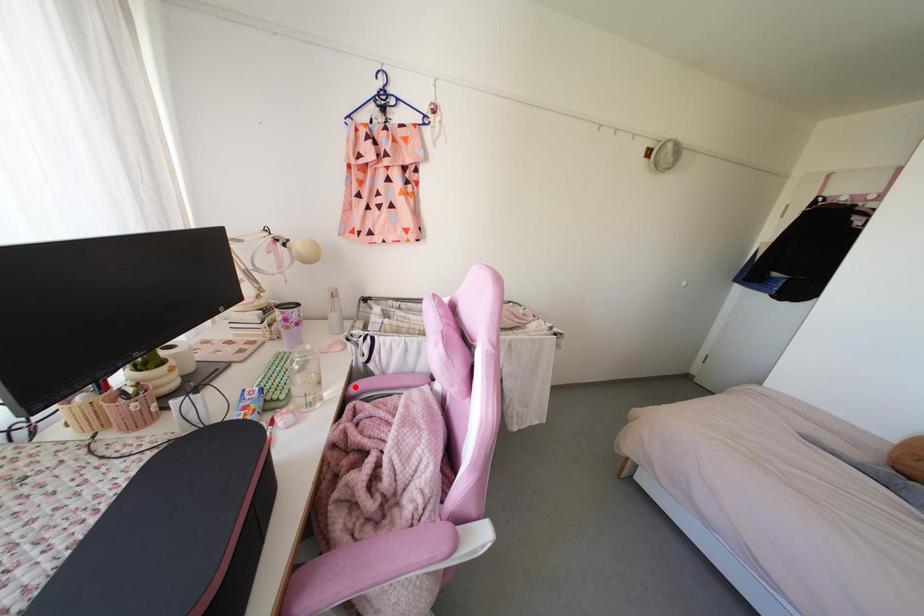
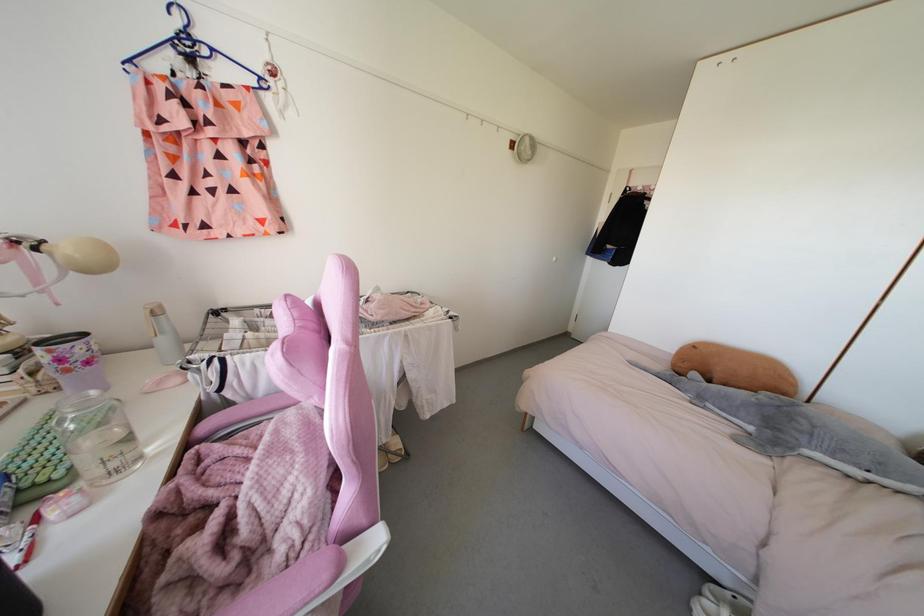
Where in the second image is the point corresponding to the highlighted location from the first image?

(204, 426)